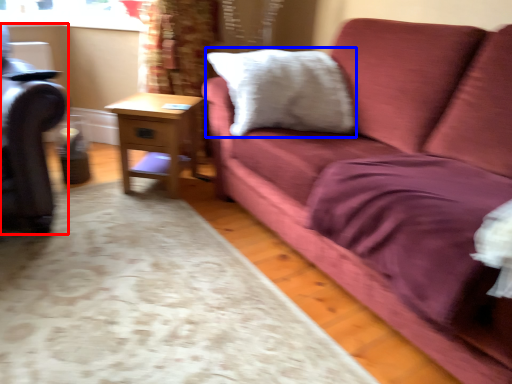
Question: Which object appears closest to the camera in this image, swivel chair (highlighted by a red box) or pillow (highlighted by a blue box)?

Choices:
 (A) swivel chair
 (B) pillow

Answer: (A)